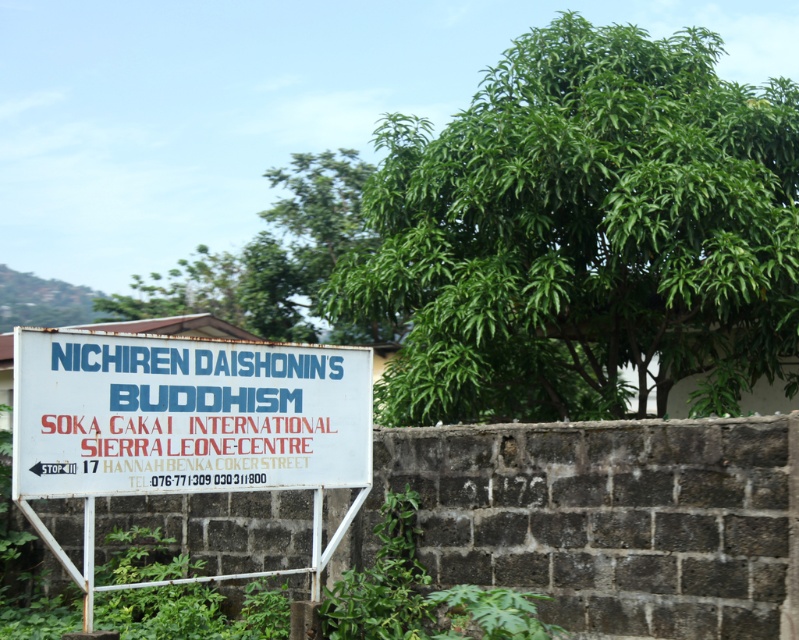
You are standing in front of the white plastic sign at center and want to take a photo of the signboard with the green leafy tree at upper right in the background. Which direction should you position yourself relative to the sign to have the tree appear behind it?

The green leafy tree at upper right is to the right of the white plastic sign at center. To have the tree appear behind the signboard, you should position yourself to the left of the white plastic sign at center so that the tree, which is on the right side, will be in the background behind the sign.

You are a delivery person who needs to place a package between the green leafy tree at upper right and the white plastic sign at center. The package requires a space of 3 meters. Is there enough space between them?

The green leafy tree at upper right and the white plastic sign at center are 2.81 meters apart from each other. Since the required space is 3 meters, there is not enough space between them to place the package.